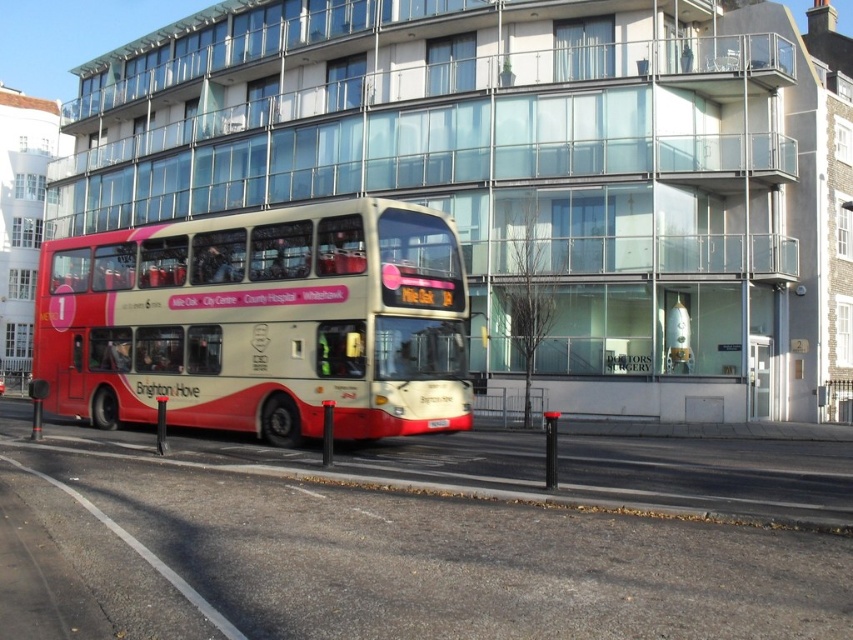
Is red matte bus at center positioned before white plastic license plate at center?

Yes, it is.

Is point (375, 410) farther from viewer compared to point (444, 422)?

No, (375, 410) is in front of (444, 422).

Between point (48, 244) and point (437, 428), which one is positioned behind?

Positioned behind is point (48, 244).

Find the location of `red matte bus at center`. red matte bus at center is located at coordinates (260, 323).